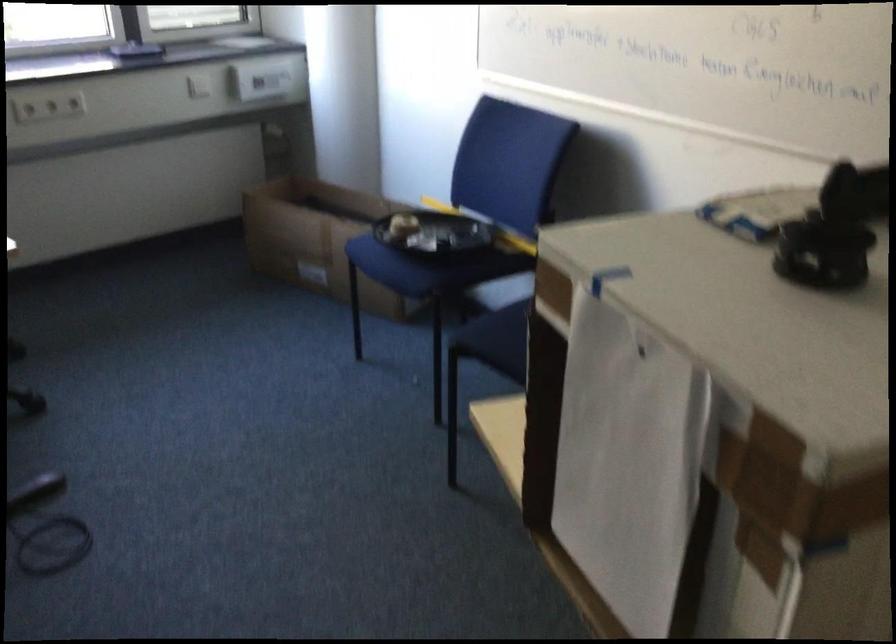
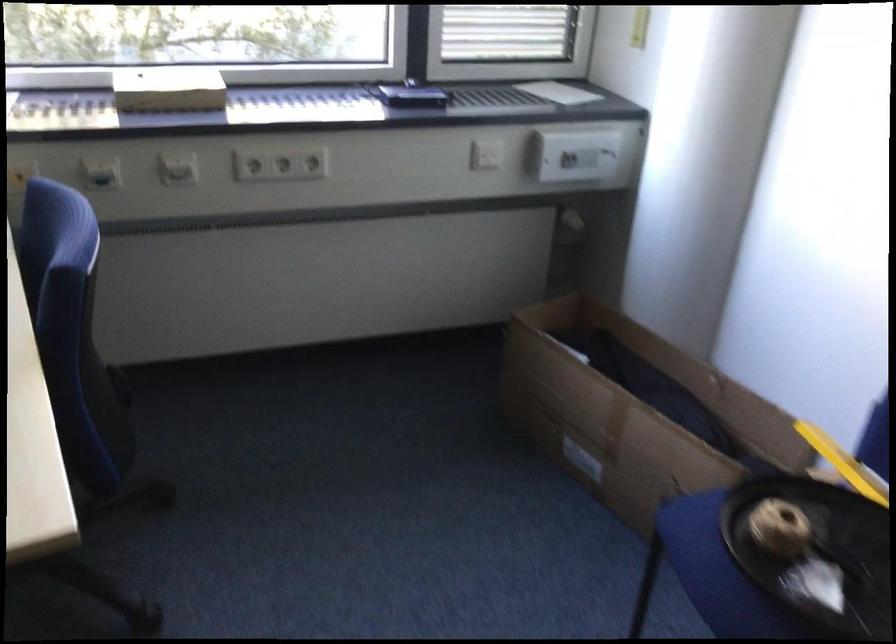
Locate, in the second image, the point that corresponds to (x=263, y=77) in the first image.

(576, 155)